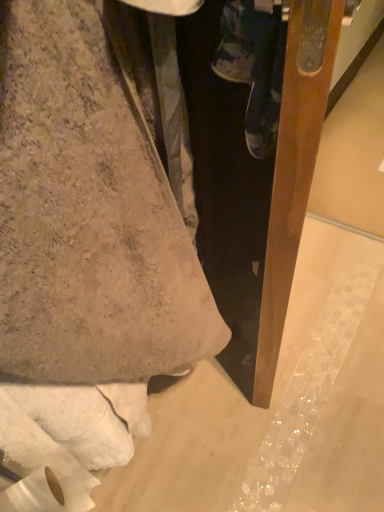
This screenshot has width=384, height=512. What do you see at coordinates (87, 220) in the screenshot?
I see `white fluffy towel at lower left` at bounding box center [87, 220].

Identify the location of white fluffy towel at lower left. The image size is (384, 512). (87, 220).

Find the location of a particular element. white fluffy towel at lower left is located at coordinates (87, 220).